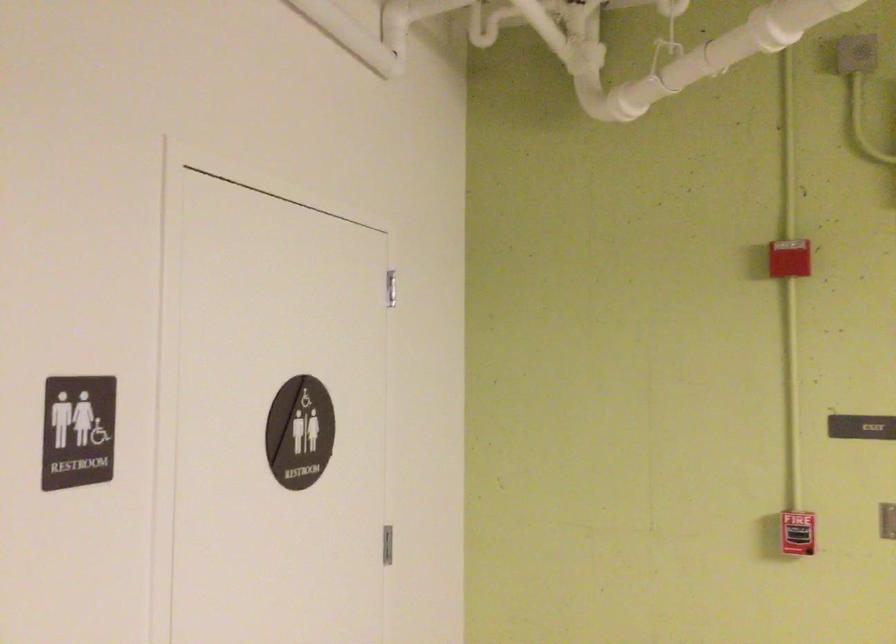
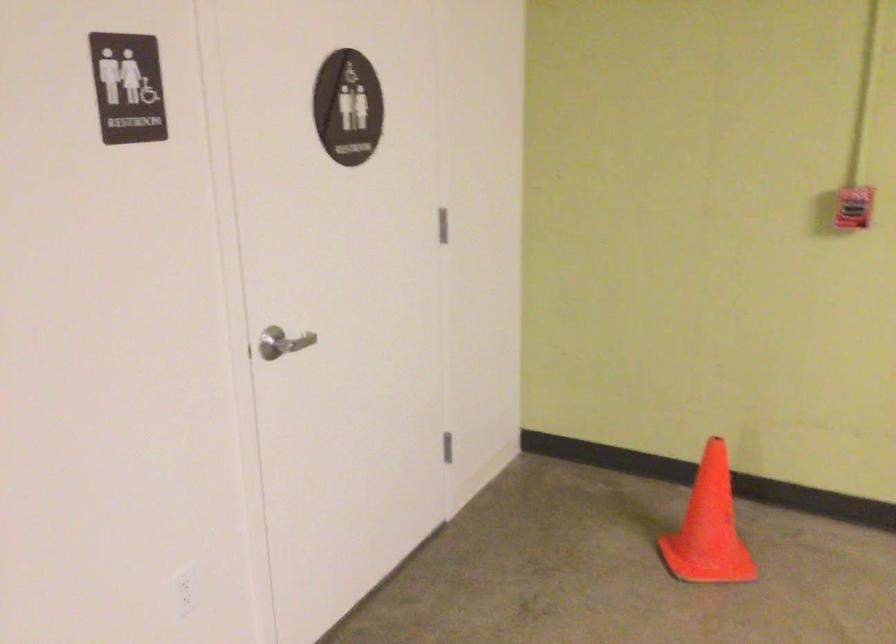
In a continuous first-person perspective shot, in which direction is the camera moving?

The cameraman walked toward right, backward.